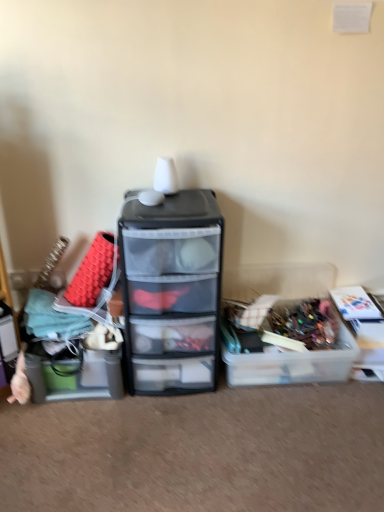
Question: Is transparent plastic drawers at center beside clear plastic storage box at right, which is the 1th storage box in right-to-left order?

Choices:
 (A) no
 (B) yes

Answer: (A)

Question: Considering the relative positions of transparent plastic drawers at center and clear plastic storage box at right, which is the 1th storage box in right-to-left order, in the image provided, is transparent plastic drawers at center in front of clear plastic storage box at right, which is the 1th storage box in right-to-left order,?

Choices:
 (A) yes
 (B) no

Answer: (A)

Question: From a real-world perspective, does transparent plastic drawers at center sit lower than clear plastic storage box at right, which is the 3th storage box in left-to-right order?

Choices:
 (A) yes
 (B) no

Answer: (B)

Question: From the image's perspective, is transparent plastic drawers at center above clear plastic storage box at right, which is the 3th storage box in left-to-right order?

Choices:
 (A) no
 (B) yes

Answer: (B)

Question: Is the depth of transparent plastic drawers at center greater than that of clear plastic storage box at right, which is the 1th storage box in right-to-left order?

Choices:
 (A) yes
 (B) no

Answer: (B)

Question: Is transparent plastic drawers at center turned away from clear plastic storage box at right, which is the 3th storage box in left-to-right order?

Choices:
 (A) no
 (B) yes

Answer: (A)

Question: Is transparent plastic drawers at center to the left of translucent plastic storage box at left, which appears as the 3th storage box when viewed from the right, from the viewer's perspective?

Choices:
 (A) no
 (B) yes

Answer: (A)

Question: Is transparent plastic drawers at center not close to translucent plastic storage box at left, acting as the 1th storage box starting from the left?

Choices:
 (A) yes
 (B) no

Answer: (B)

Question: From a real-world perspective, is transparent plastic drawers at center positioned over translucent plastic storage box at left, acting as the 1th storage box starting from the left, based on gravity?

Choices:
 (A) yes
 (B) no

Answer: (A)

Question: Could you tell me if transparent plastic drawers at center is turned towards translucent plastic storage box at left, which appears as the 3th storage box when viewed from the right?

Choices:
 (A) yes
 (B) no

Answer: (B)

Question: Can you confirm if transparent plastic drawers at center is wider than translucent plastic storage box at left, which appears as the 3th storage box when viewed from the right?

Choices:
 (A) yes
 (B) no

Answer: (A)

Question: Would you say transparent plastic drawers at center contains translucent plastic storage box at left, which appears as the 3th storage box when viewed from the right?

Choices:
 (A) yes
 (B) no

Answer: (B)

Question: Can you confirm if translucent plastic storage box at left, which appears as the 3th storage box when viewed from the right, is bigger than translucent plastic container at center-right, which is counted as the second storage box, starting from the right?

Choices:
 (A) yes
 (B) no

Answer: (B)